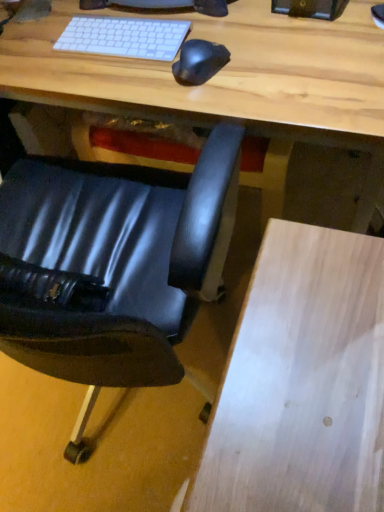
Question: Does black rubber mouse at center appear on the right side of light wood desk at center?

Choices:
 (A) yes
 (B) no

Answer: (B)

Question: From a real-world perspective, is black rubber mouse at center positioned under light wood desk at center based on gravity?

Choices:
 (A) no
 (B) yes

Answer: (A)

Question: From the image's perspective, would you say black rubber mouse at center is shown under light wood desk at center?

Choices:
 (A) yes
 (B) no

Answer: (A)

Question: Is black rubber mouse at center outside of light wood desk at center?

Choices:
 (A) no
 (B) yes

Answer: (A)

Question: Can you confirm if black rubber mouse at center is thinner than light wood desk at center?

Choices:
 (A) no
 (B) yes

Answer: (B)

Question: Considering their positions, is black leather chair at lower left located in front of or behind black rubber mouse at center?

Choices:
 (A) front
 (B) behind

Answer: (A)

Question: Is black leather chair at lower left inside the boundaries of black rubber mouse at center, or outside?

Choices:
 (A) outside
 (B) inside

Answer: (A)

Question: In terms of height, does black leather chair at lower left look taller or shorter compared to black rubber mouse at center?

Choices:
 (A) short
 (B) tall

Answer: (B)

Question: Is point (8, 332) positioned closer to the camera than point (221, 47)?

Choices:
 (A) farther
 (B) closer

Answer: (B)

Question: Based on their sizes in the image, would you say light wood desk at center is bigger or smaller than black leather chair at lower left?

Choices:
 (A) small
 (B) big

Answer: (B)

Question: From a real-world perspective, relative to black leather chair at lower left, is light wood desk at center vertically above or below?

Choices:
 (A) above
 (B) below

Answer: (B)

Question: Considering the relative positions of light wood desk at center and black leather chair at lower left in the image provided, is light wood desk at center to the left or to the right of black leather chair at lower left?

Choices:
 (A) left
 (B) right

Answer: (B)

Question: From the image's perspective, is light wood desk at center positioned above or below black leather chair at lower left?

Choices:
 (A) below
 (B) above

Answer: (B)

Question: Considering their positions, is black rubber mouse at center located in front of or behind black leather chair at lower left?

Choices:
 (A) front
 (B) behind

Answer: (B)

Question: From their relative heights in the image, would you say black rubber mouse at center is taller or shorter than black leather chair at lower left?

Choices:
 (A) tall
 (B) short

Answer: (B)